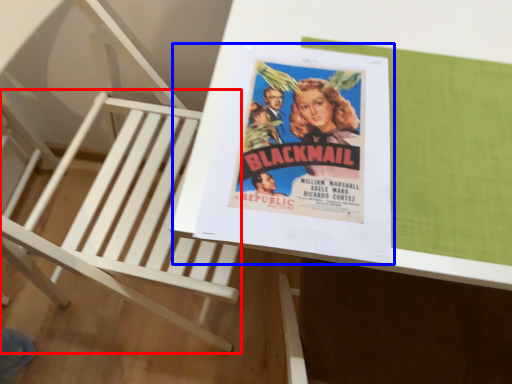
Question: Among these objects, which one is nearest to the camera, furniture (highlighted by a red box) or paperback book (highlighted by a blue box)?

Choices:
 (A) furniture
 (B) paperback book

Answer: (A)